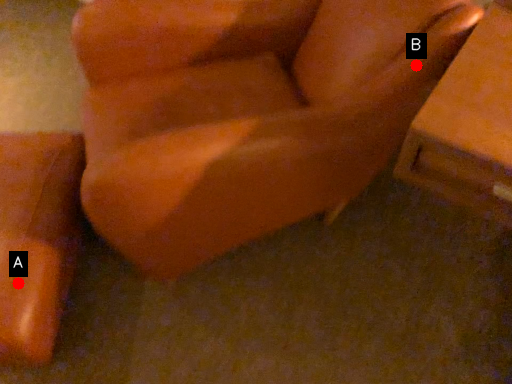
Question: Two points are circled on the image, labeled by A and B beside each circle. Which point is closer to the camera taking this photo?

Choices:
 (A) A is closer
 (B) B is closer

Answer: (A)